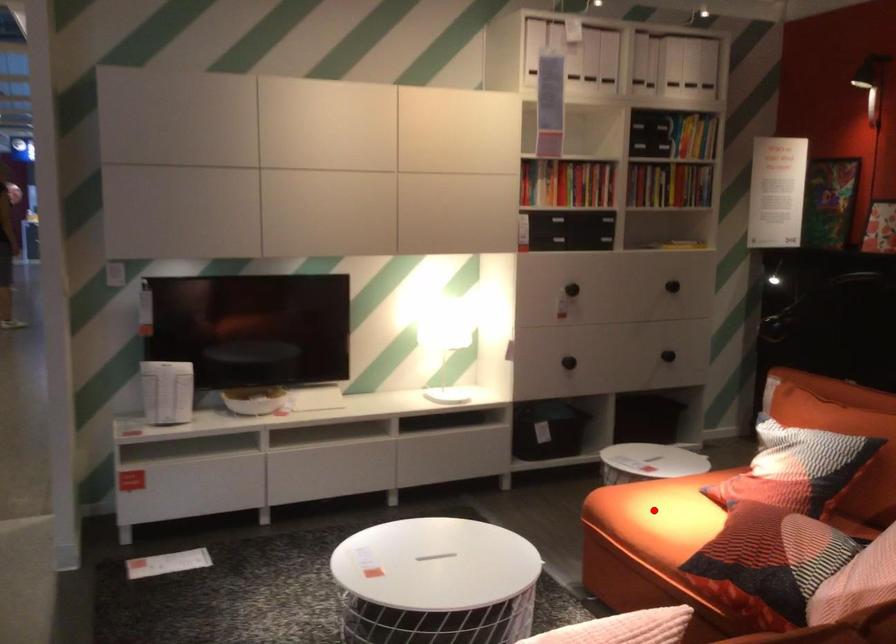
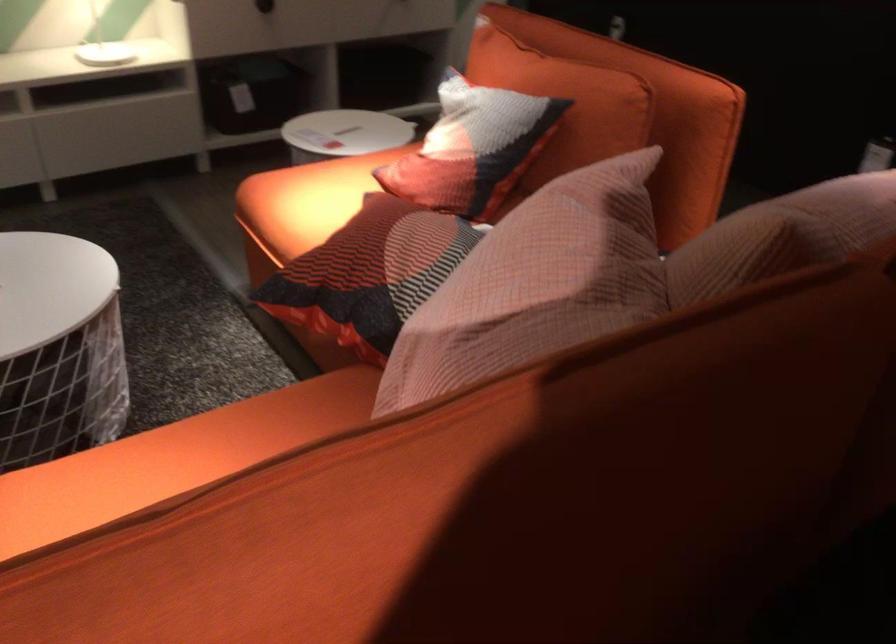
The point at the highlighted location is marked in the first image. Where is the corresponding point in the second image?

(306, 200)